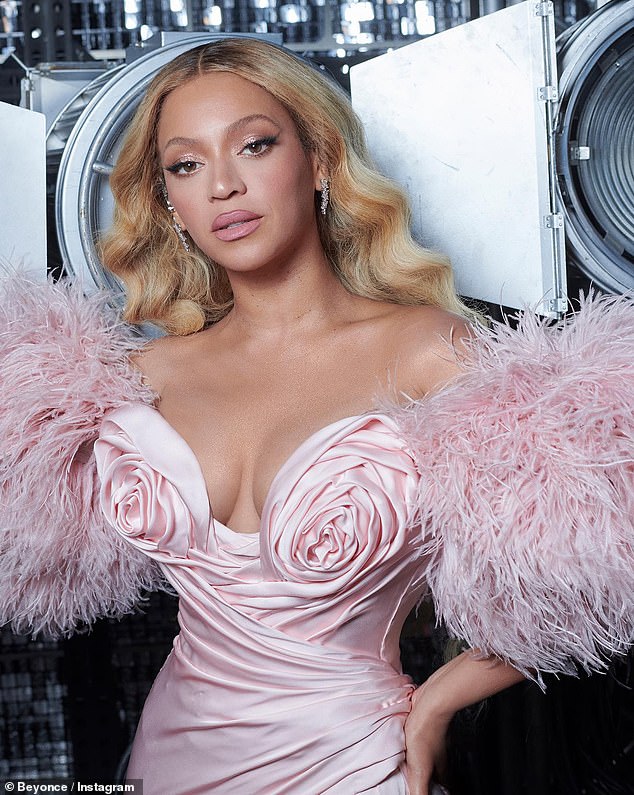
The image size is (634, 795). I want to click on spotlight, so click(614, 159), click(96, 202).